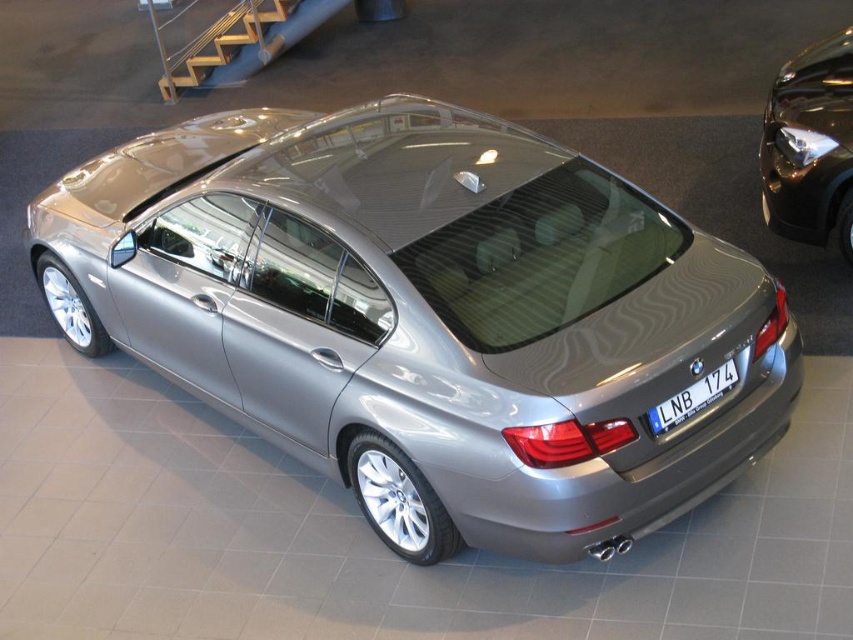
You are standing in a car showroom and want to take a photo of the satin metallic car at center. If your camera has a maximum focus range of 10 feet, will you need to move closer to capture a clear image?

The distance between the satin metallic car at center and the camera is 10.91 feet, which exceeds the camera maximum focus range of 10 feet. Therefore, you need to move closer to ensure the car is in focus.

You are a parking attendant and need to fit both the satin metallic car at center and the glossy black car at upper right into a parking spot that is 2 meters wide. Based on their widths, which car should be placed first to ensure both can fit?

The glossy black car at upper right should be placed first since it is narrower than the satin metallic car at center. This way, both cars can fit within the 2 meter wide parking spot.

You are standing in a BMW showroom and want to take a photo of the satin metallic car at center. If your camera has a maximum focus range of 3 meters, will you need to move closer to capture a clear image?

The satin metallic car at center is 3.33 meters away from the viewer. Since the camera can only focus up to 3 meters, you need to move closer to ensure the car is within the focus range.